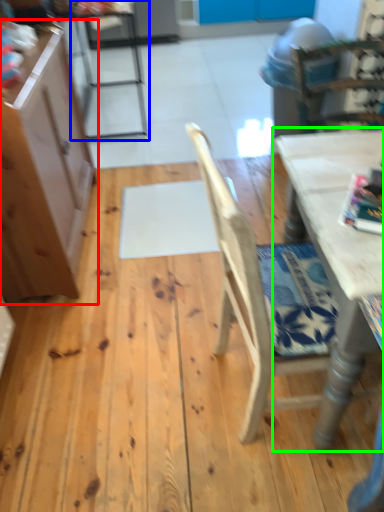
Question: Which is farther away from cabinetry (highlighted by a red box)? chair (highlighted by a blue box) or table (highlighted by a green box)?

Choices:
 (A) chair
 (B) table

Answer: (A)